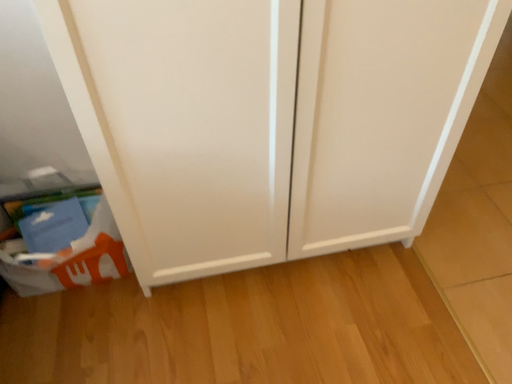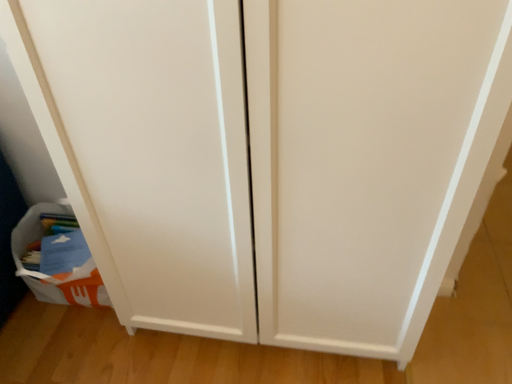
Question: Which way did the camera rotate in the video?

Choices:
 (A) rotated left
 (B) rotated right

Answer: (A)